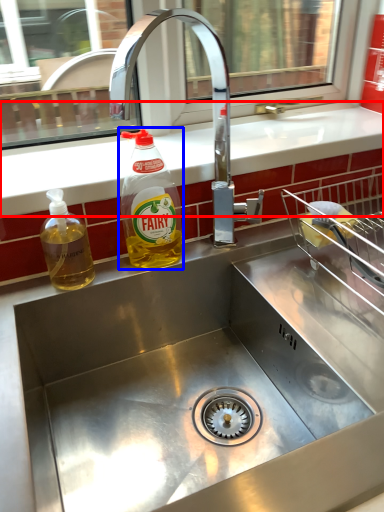
Question: Which of the following is the farthest to the observer, counter top (highlighted by a red box) or bottle (highlighted by a blue box)?

Choices:
 (A) counter top
 (B) bottle

Answer: (A)